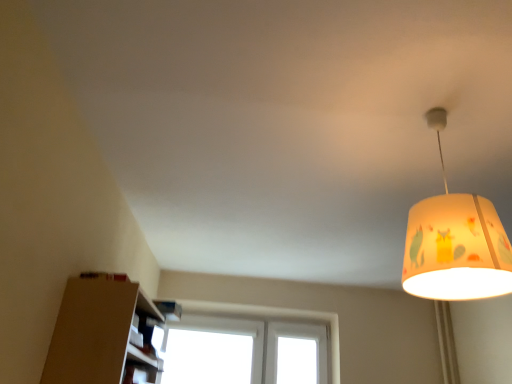
Question: Can you confirm if white plastic window at center is taller than yellow fabric lampshade at upper right?

Choices:
 (A) no
 (B) yes

Answer: (B)

Question: Is white plastic window at center thinner than yellow fabric lampshade at upper right?

Choices:
 (A) no
 (B) yes

Answer: (B)

Question: Is white plastic window at center further to camera compared to yellow fabric lampshade at upper right?

Choices:
 (A) no
 (B) yes

Answer: (B)

Question: Does white plastic window at center have a greater width compared to yellow fabric lampshade at upper right?

Choices:
 (A) no
 (B) yes

Answer: (A)

Question: From a real-world perspective, is white plastic window at center positioned under yellow fabric lampshade at upper right based on gravity?

Choices:
 (A) yes
 (B) no

Answer: (A)

Question: Considering the relative sizes of white plastic window at center and yellow fabric lampshade at upper right in the image provided, is white plastic window at center bigger than yellow fabric lampshade at upper right?

Choices:
 (A) no
 (B) yes

Answer: (B)

Question: Is yellow fabric lampshade at upper right thinner than white plastic window at center?

Choices:
 (A) no
 (B) yes

Answer: (A)

Question: Is yellow fabric lampshade at upper right to the right of white plastic window at center from the viewer's perspective?

Choices:
 (A) yes
 (B) no

Answer: (A)

Question: From a real-world perspective, is yellow fabric lampshade at upper right on top of white plastic window at center?

Choices:
 (A) no
 (B) yes

Answer: (B)

Question: Can you confirm if yellow fabric lampshade at upper right is taller than white plastic window at center?

Choices:
 (A) no
 (B) yes

Answer: (A)

Question: Is the position of yellow fabric lampshade at upper right less distant than that of white plastic window at center?

Choices:
 (A) yes
 (B) no

Answer: (A)

Question: Is yellow fabric lampshade at upper right oriented away from white plastic window at center?

Choices:
 (A) no
 (B) yes

Answer: (A)

Question: Considering the relative positions of yellow fabric lampshade at upper right and white plastic window at center in the image provided, is yellow fabric lampshade at upper right to the left or to the right of white plastic window at center?

Choices:
 (A) left
 (B) right

Answer: (B)